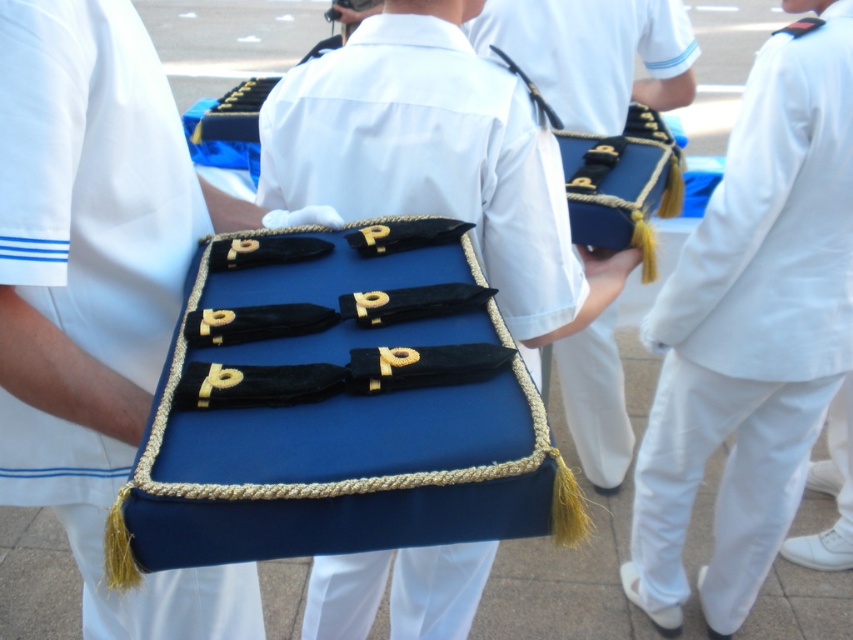
Consider the image. You are a member of the ceremonial unit holding the blue box. You notice two points marked on the box. One is at point (x=51, y=240) and the other at point (x=767, y=401). Which point is closer to you?

Point (x=51, y=240) is closer to the viewer than point (x=767, y=401).

You are a member of the ceremonial unit and need to determine if the blue velvet case at center can fit inside the white cotton pants at right. Based on their sizes, what is your assessment?

The blue velvet case at center is smaller than the white cotton pants at right, so it can fit inside the white cotton pants at right.